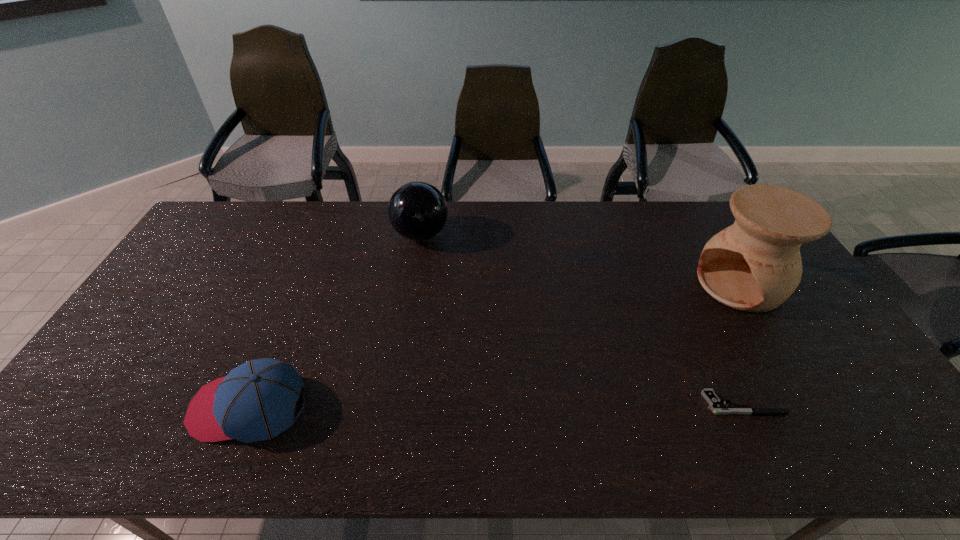
At what (x,y) coordinates should I click in order to perform the action: click on vacant space located 0.190m on the front-facing side of the shortest object. Please return your answer as a coordinate pair (x, y). Looking at the image, I should click on (858, 403).

You are a GUI agent. You are given a task and a screenshot of the screen. Output one action in this format:
    pyautogui.click(x=<x>, y=<y>)
    Task: Click on the vacant region located 0.170m at the open side of the tallest object
    The image size is (960, 540).
    Given the screenshot: What is the action you would take?
    pyautogui.click(x=673, y=323)

Locate an element on the screen. The width and height of the screenshot is (960, 540). free space located 0.250m at the open side of the tallest object is located at coordinates (654, 334).

Find the location of a particular element. The width and height of the screenshot is (960, 540). free space located 0.280m at the open side of the tallest object is located at coordinates (646, 339).

You are a GUI agent. You are given a task and a screenshot of the screen. Output one action in this format:
    pyautogui.click(x=<x>, y=<y>)
    Task: Click on the free space located 0.380m on the side of the third shortest object with the finger holes
    This screenshot has height=540, width=960.
    Given the screenshot: What is the action you would take?
    pyautogui.click(x=461, y=336)

Find the location of a particular element. Image resolution: width=960 pixels, height=540 pixels. vacant area situated on the side of the third shortest object with the finger holes is located at coordinates (439, 279).

This screenshot has width=960, height=540. Identify the location of vacant region located 0.300m on the side of the third shortest object with the finger holes. (452, 315).

Locate an element on the screen. This screenshot has height=540, width=960. object that is positioned at the far edge is located at coordinates (417, 210).

Find the location of `baseball cap present at the near edge`. baseball cap present at the near edge is located at coordinates (256, 401).

At what (x,y) coordinates should I click in order to perform the action: click on pistol present at the near edge. Please return your answer as a coordinate pair (x, y). This screenshot has width=960, height=540. Looking at the image, I should click on (715, 404).